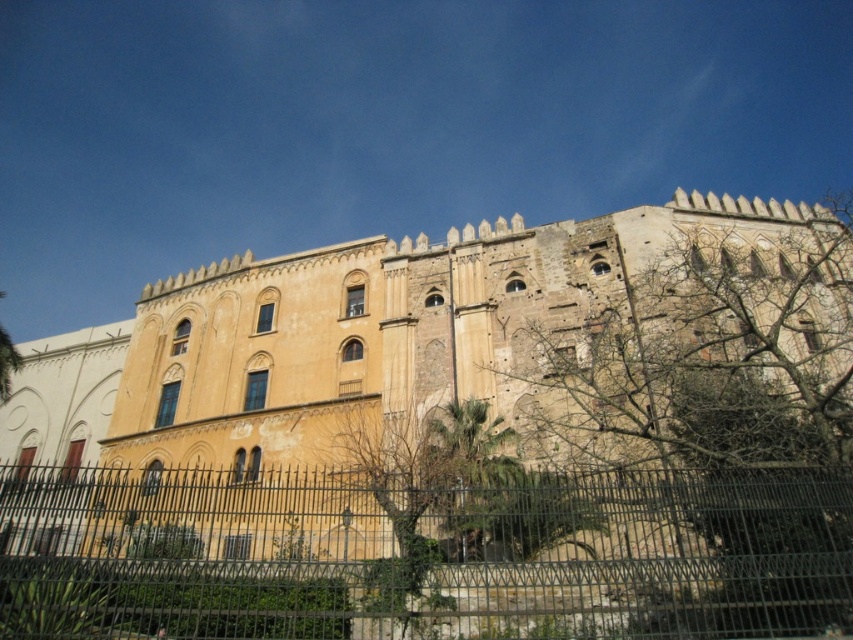
Question: Which of the following is the farthest from the observer?

Choices:
 (A) black metal fence at lower center
 (B) yellow stone building at center

Answer: (B)

Question: Based on their relative distances, which object is farther from the bare branches at upper right?

Choices:
 (A) yellow stone building at center
 (B) black metal fence at lower center

Answer: (B)

Question: Does black metal fence at lower center appear on the right side of bare branches at upper right?

Choices:
 (A) yes
 (B) no

Answer: (B)

Question: Based on their relative distances, which object is nearer to the bare branches at upper right?

Choices:
 (A) black metal fence at lower center
 (B) yellow stone building at center

Answer: (B)

Question: Does yellow stone building at center appear over black metal fence at lower center?

Choices:
 (A) yes
 (B) no

Answer: (A)

Question: Is black metal fence at lower center thinner than bare branches at upper right?

Choices:
 (A) yes
 (B) no

Answer: (B)